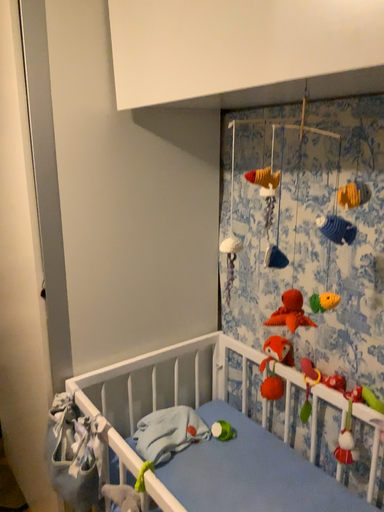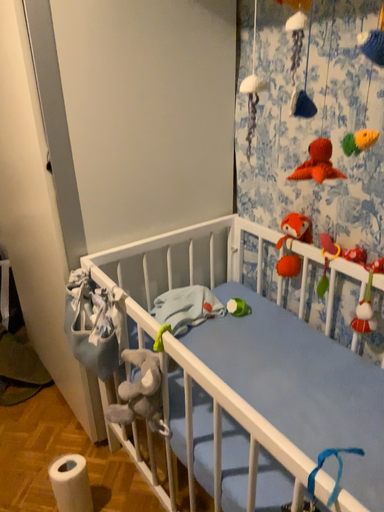
Question: Which way did the camera rotate in the video?

Choices:
 (A) rotated upward
 (B) rotated downward

Answer: (B)